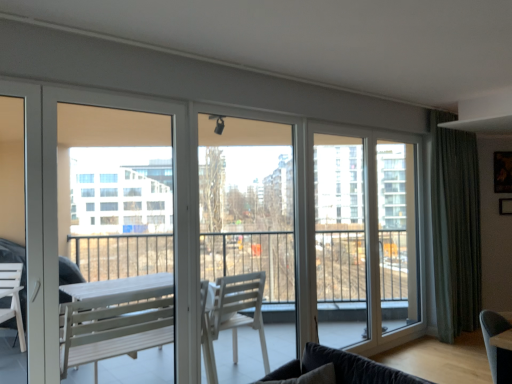
Question: Is velvet dark gray studio couch at lower right positioned behind white matte screen door at left, the second screen door from the right?

Choices:
 (A) yes
 (B) no

Answer: (B)

Question: Does velvet dark gray studio couch at lower right have a greater width compared to white matte screen door at left, arranged as the 1th screen door when viewed from the front?

Choices:
 (A) no
 (B) yes

Answer: (B)

Question: Can you confirm if velvet dark gray studio couch at lower right is shorter than white matte screen door at left, the 1th screen door viewed from the left?

Choices:
 (A) no
 (B) yes

Answer: (B)

Question: Is velvet dark gray studio couch at lower right to the left of white matte screen door at left, the 1th screen door viewed from the left, from the viewer's perspective?

Choices:
 (A) yes
 (B) no

Answer: (B)

Question: From the image's perspective, is velvet dark gray studio couch at lower right over white matte screen door at left, the 1th screen door viewed from the left?

Choices:
 (A) no
 (B) yes

Answer: (A)

Question: Does velvet dark gray studio couch at lower right have a larger size compared to white matte screen door at left, arranged as the 1th screen door when viewed from the front?

Choices:
 (A) no
 (B) yes

Answer: (A)

Question: From a real-world perspective, is green textured curtain at right positioned under velvet dark gray studio couch at lower right based on gravity?

Choices:
 (A) yes
 (B) no

Answer: (B)

Question: Does green textured curtain at right have a smaller size compared to velvet dark gray studio couch at lower right?

Choices:
 (A) no
 (B) yes

Answer: (A)

Question: From the image's perspective, would you say green textured curtain at right is shown under velvet dark gray studio couch at lower right?

Choices:
 (A) no
 (B) yes

Answer: (A)

Question: Is green textured curtain at right next to velvet dark gray studio couch at lower right?

Choices:
 (A) no
 (B) yes

Answer: (A)

Question: Considering the relative sizes of green textured curtain at right and velvet dark gray studio couch at lower right in the image provided, is green textured curtain at right bigger than velvet dark gray studio couch at lower right?

Choices:
 (A) no
 (B) yes

Answer: (B)

Question: From a real-world perspective, is green textured curtain at right on velvet dark gray studio couch at lower right?

Choices:
 (A) no
 (B) yes

Answer: (B)

Question: Considering the relative sizes of transparent glass window at center and white matte screen door at left, the 1th screen door viewed from the left, in the image provided, is transparent glass window at center smaller than white matte screen door at left, the 1th screen door viewed from the left,?

Choices:
 (A) no
 (B) yes

Answer: (A)